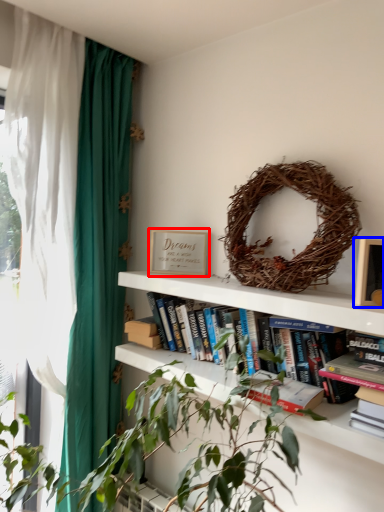
Question: Which point is further to the camera, paperback book (highlighted by a red box) or picture frame (highlighted by a blue box)?

Choices:
 (A) paperback book
 (B) picture frame

Answer: (A)